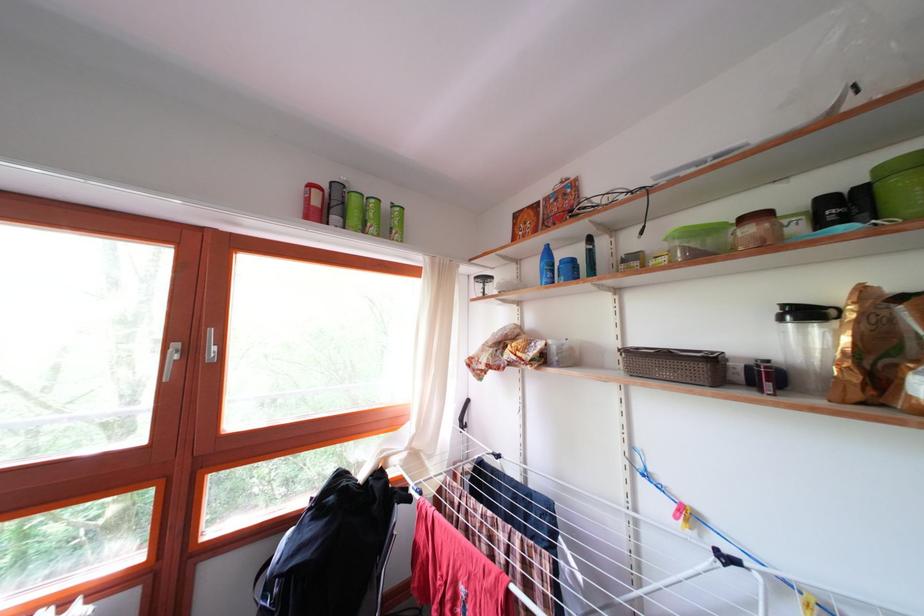
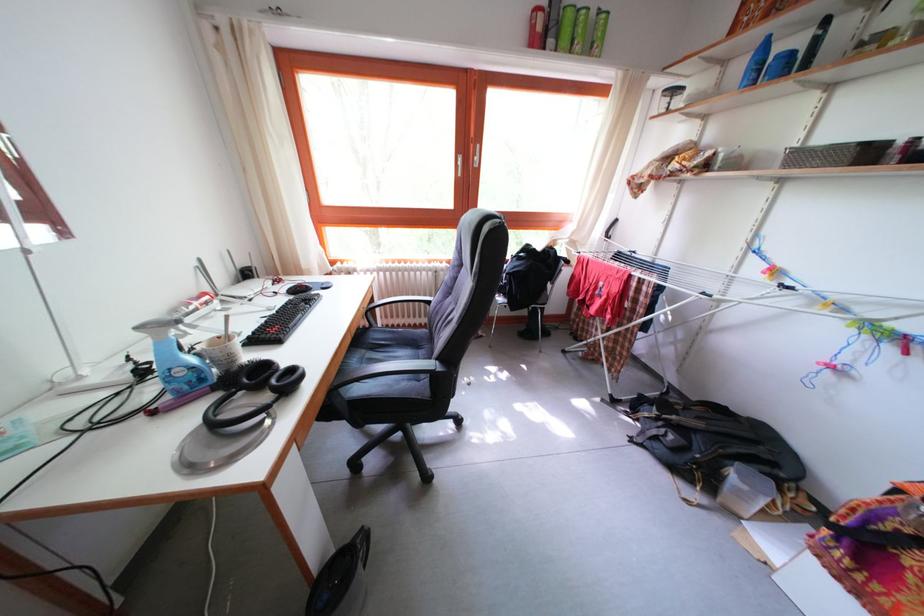
First-person continuous shooting, in which direction is the camera rotating?

The camera's rotation is toward left-down.